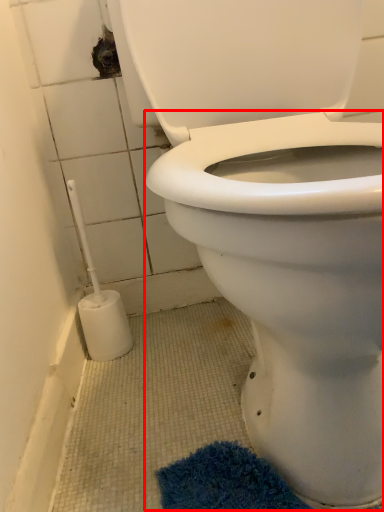
Question: Where is bidet (annotated by the red box) located in relation to brush in the image?

Choices:
 (A) right
 (B) left

Answer: (A)